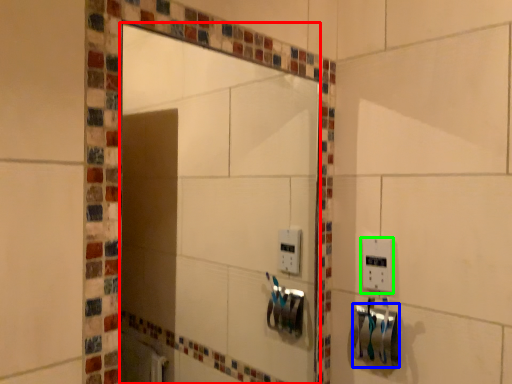
Question: Which object is the closest to the mirror (highlighted by a red box)? Choose among these: towel bar (highlighted by a blue box) or light switch (highlighted by a green box).

Choices:
 (A) towel bar
 (B) light switch

Answer: (A)